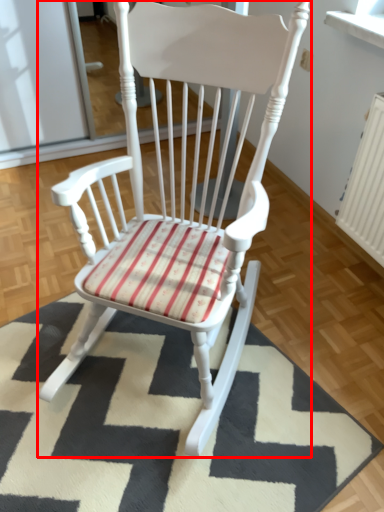
Question: From the image's perspective, what is the correct spatial relationship of chair (annotated by the red box) in relation to mat?

Choices:
 (A) below
 (B) above

Answer: (B)